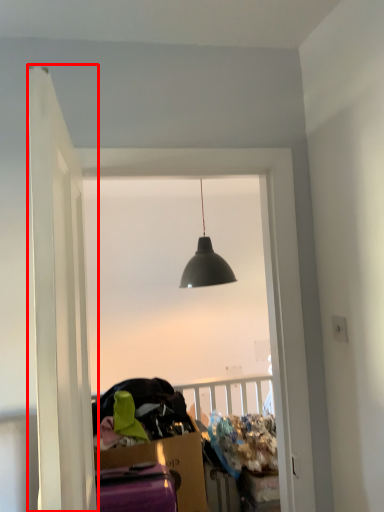
Question: From the image's perspective, what is the correct spatial positioning of door (annotated by the red box) in reference to window?

Choices:
 (A) above
 (B) below

Answer: (A)